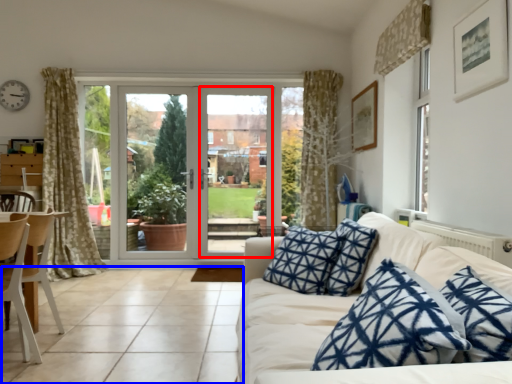
Question: Which point is further to the camera, screen door (highlighted by a red box) or tile (highlighted by a blue box)?

Choices:
 (A) screen door
 (B) tile

Answer: (A)